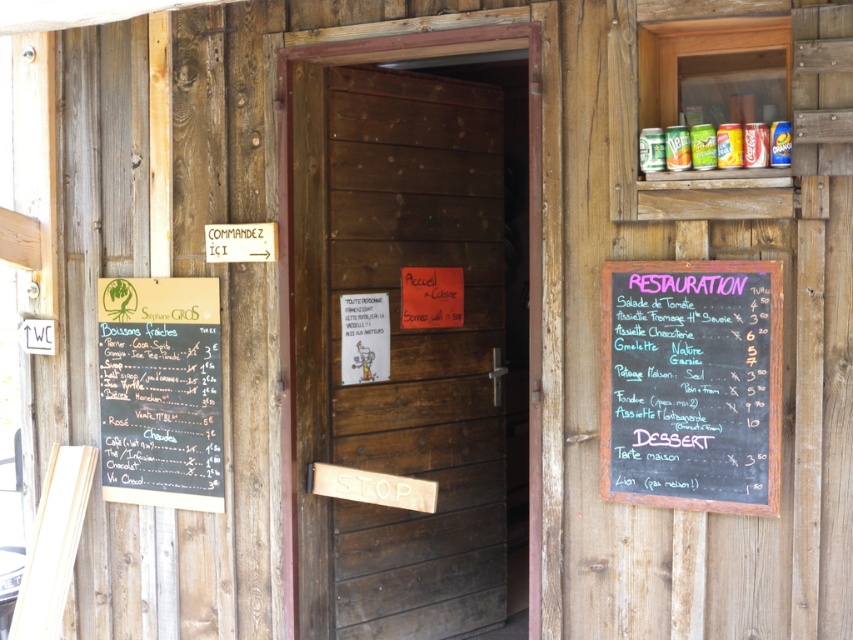
Question: Which object is the closest to the dark wood door at center?

Choices:
 (A) black chalkboard at right
 (B) black chalkboard menu at left

Answer: (B)

Question: Which point is farther to the camera?

Choices:
 (A) (608, 307)
 (B) (186, 310)
 (C) (430, 540)

Answer: (C)

Question: Does dark wood door at center appear under black chalkboard menu at left?

Choices:
 (A) no
 (B) yes

Answer: (A)

Question: Does dark wood door at center have a smaller size compared to black chalkboard at right?

Choices:
 (A) no
 (B) yes

Answer: (A)

Question: Is dark wood door at center smaller than black chalkboard at right?

Choices:
 (A) yes
 (B) no

Answer: (B)

Question: Estimate the real-world distances between objects in this image. Which object is farther from the black chalkboard at right?

Choices:
 (A) dark wood door at center
 (B) black chalkboard menu at left

Answer: (B)